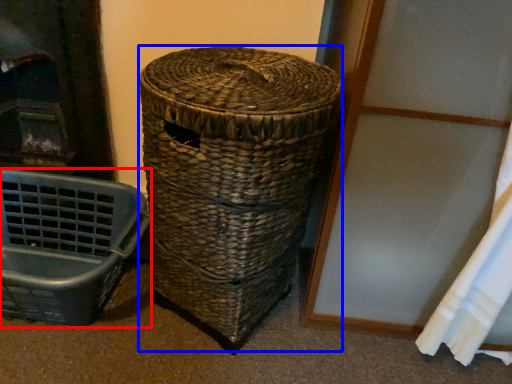
Question: Which of the following is the farthest to the observer, furniture (highlighted by a red box) or basket (highlighted by a blue box)?

Choices:
 (A) furniture
 (B) basket

Answer: (A)